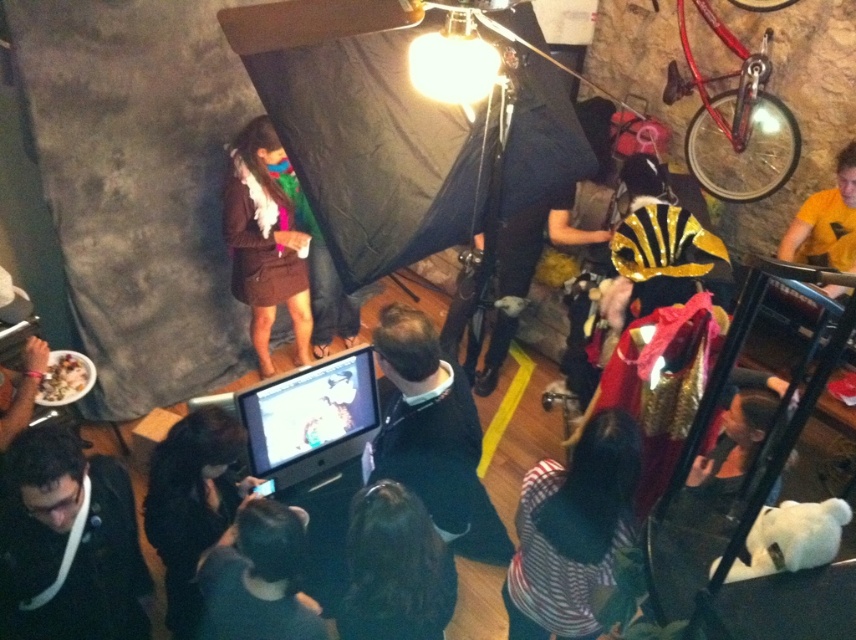
You are standing at the center of the room and want to pick up the dark fabric mask at lower center. In which direction should you move relative to your current position?

The dark fabric mask at lower center is located at coordinates 0.903 on the x axis and 0.303 on the y axis. Since you are at the center, you should move towards the right and slightly downward to reach it.

In the scene, there are two points labeled as point 1 at coordinates point (119, 608) and point 2 at coordinates point (224, 634). From the perspective of someone standing in the room, which point is closer to the front of the scene?

Point 2 at coordinates point (224, 634) is closer to the front of the scene because point 1 at coordinates point (119, 608) is behind it.

You are organizing a photo shoot and need to place a black matte jacket at lower left and a black matte camera at center. According to the scene description, which object is located to the left of the other?

The black matte jacket at lower left is positioned on the left side of the black matte camera at center.